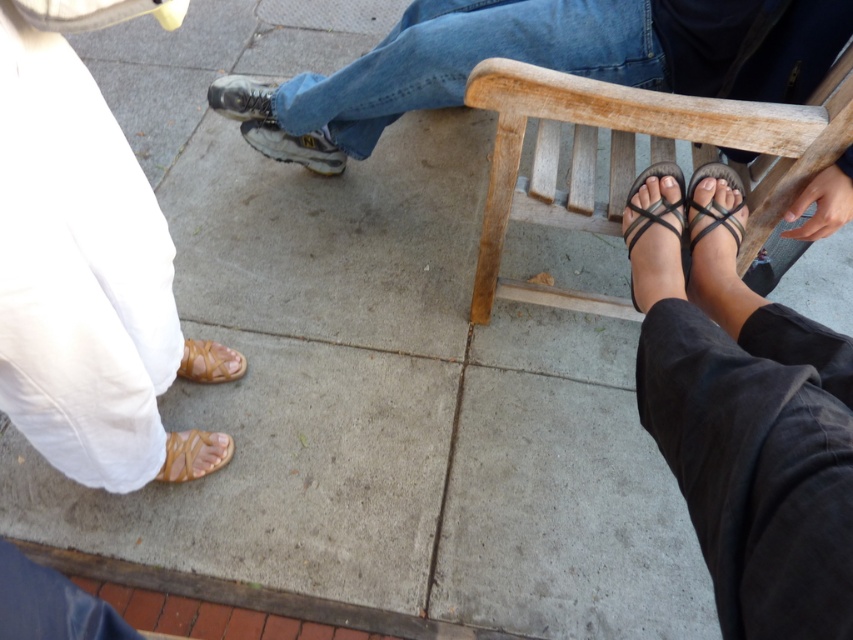
Which of these two, denim jeans at upper center or leather shoe at center, stands shorter?

leather shoe at center

Can you confirm if denim jeans at upper center is bigger than leather shoe at center?

Yes, denim jeans at upper center is bigger than leather shoe at center.

Does point (294, 104) come farther from viewer compared to point (213, 83)?

No.

The width and height of the screenshot is (853, 640). I want to click on denim jeans at upper center, so click(556, 60).

Is wooden chair at center positioned at the back of brown woven sandal at lower right?

Yes, it is behind brown woven sandal at lower right.

Consider the image. Does wooden chair at center appear on the right side of brown woven sandal at lower right?

No, wooden chair at center is not to the right of brown woven sandal at lower right.

Find the location of a particular element. wooden chair at center is located at coordinates (634, 157).

Is point (643, 355) more distant than point (247, 116)?

That is False.

Is point (809, 516) closer to viewer compared to point (254, 80)?

Yes, point (809, 516) is in front of point (254, 80).

The height and width of the screenshot is (640, 853). I want to click on black leather sandals at lower right, so click(744, 417).